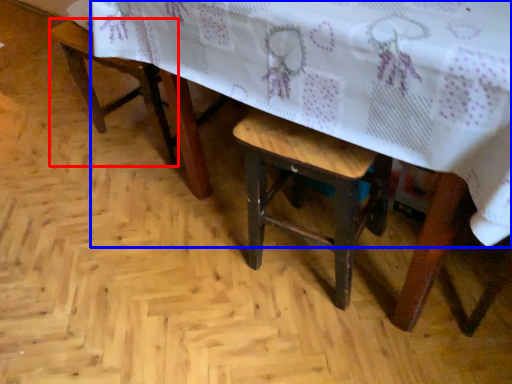
Question: Which object is closer to the camera taking this photo, armchair (highlighted by a red box) or table (highlighted by a blue box)?

Choices:
 (A) armchair
 (B) table

Answer: (B)